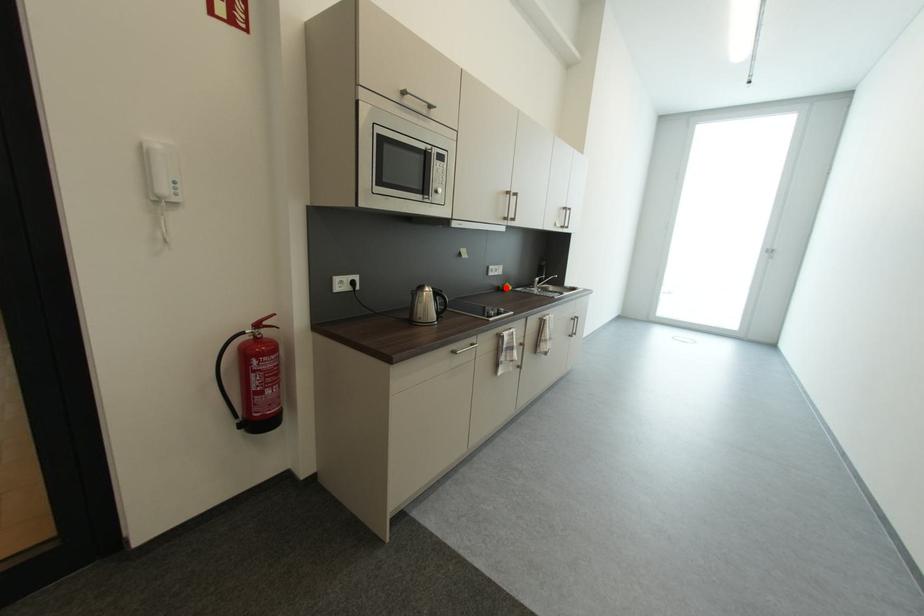
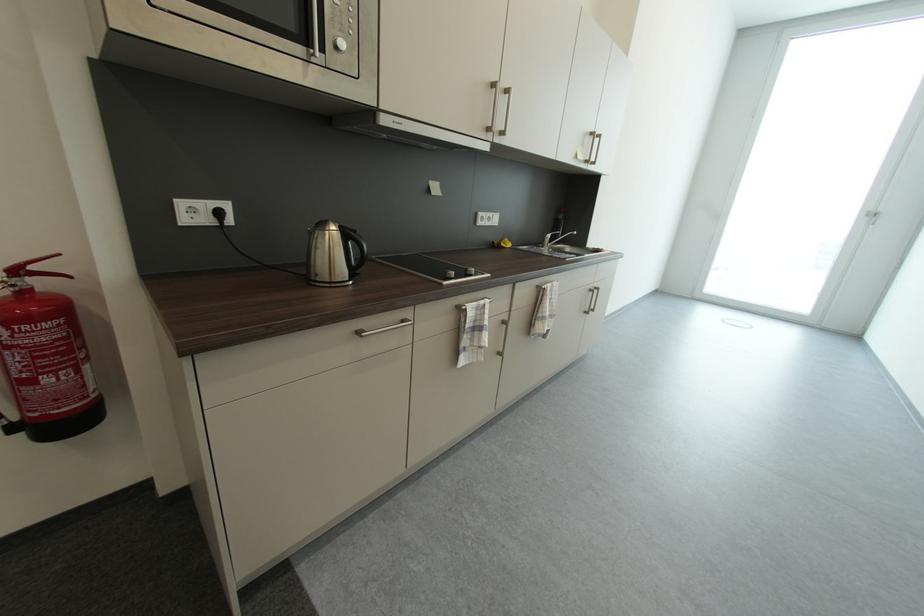
Find the pixel in the second image that matches the highlighted location in the first image.

(501, 244)